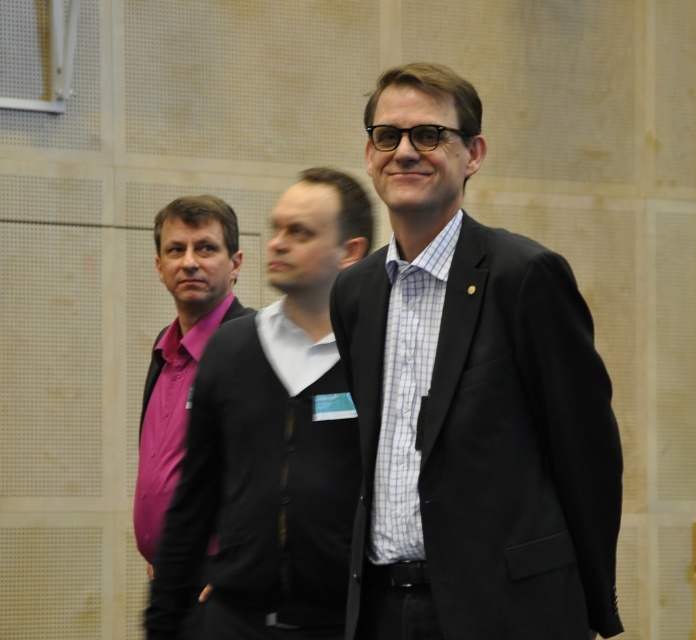
Does point (498, 624) come behind point (203, 548)?

That is False.

Measure the distance between point (557, 316) and camera.

The distance of point (557, 316) from camera is 3.43 meters.

Does point (379, 561) come farther from viewer compared to point (237, 320)?

No, (379, 561) is closer to viewer.

Locate an element on the screen. matte black suit at center is located at coordinates (470, 401).